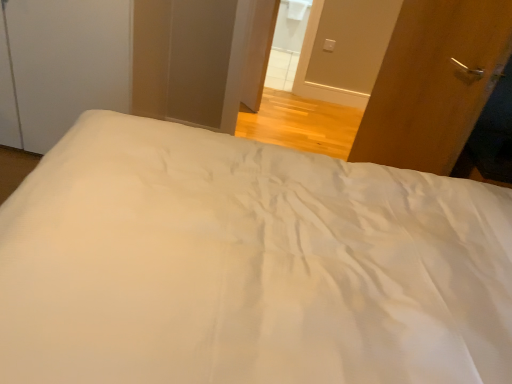
Where is `wooden door at right`? The width and height of the screenshot is (512, 384). wooden door at right is located at coordinates (434, 83).

In order to click on white matte screen door at upper left, the 1th screen door viewed from the left in this screenshot , I will do `click(67, 63)`.

What do you see at coordinates (67, 63) in the screenshot? I see `white matte screen door at upper left, the 1th screen door viewed from the left` at bounding box center [67, 63].

Describe the element at coordinates (247, 265) in the screenshot. This screenshot has width=512, height=384. I see `white smooth bed at center` at that location.

Measure the distance between white glossy door at upper center, which appears as the first screen door when viewed from the right, and camera.

The distance of white glossy door at upper center, which appears as the first screen door when viewed from the right, from camera is 3.35 meters.

You are a GUI agent. You are given a task and a screenshot of the screen. Output one action in this format:
    pyautogui.click(x=<x>, y=<y>)
    Task: Click on the wooden door at right
    This screenshot has width=512, height=384.
    Given the screenshot: What is the action you would take?
    pyautogui.click(x=434, y=83)

Is white matte screen door at upper left, the 2th screen door positioned from the right, in front of or behind white glossy door at upper center, which ranks as the second screen door in left-to-right order, in the image?

white matte screen door at upper left, the 2th screen door positioned from the right, is in front of white glossy door at upper center, which ranks as the second screen door in left-to-right order.

Can you tell me how much white matte screen door at upper left, the 1th screen door viewed from the left, and white glossy door at upper center, which appears as the first screen door when viewed from the right, differ in facing direction?

They differ by 1.06 degrees in their facing directions.

Based on their positions, is white matte screen door at upper left, the 2th screen door positioned from the right, located to the left or right of white glossy door at upper center, which ranks as the second screen door in left-to-right order?

Based on their positions, white matte screen door at upper left, the 2th screen door positioned from the right, is located to the left of white glossy door at upper center, which ranks as the second screen door in left-to-right order.

Is white glossy door at upper center, which ranks as the second screen door in left-to-right order, completely or partially inside white matte screen door at upper left, the 1th screen door viewed from the left?

That's incorrect, white glossy door at upper center, which ranks as the second screen door in left-to-right order, is not inside white matte screen door at upper left, the 1th screen door viewed from the left.

Does point (333, 5) come in front of point (101, 187)?

No, (333, 5) is further to viewer.

Who is bigger, white glossy door at upper center, which ranks as the second screen door in left-to-right order, or white smooth bed at center?

Bigger between the two is white smooth bed at center.

Consider the image. Does white glossy door at upper center, which appears as the first screen door when viewed from the right, have a lesser width compared to white smooth bed at center?

Correct, the width of white glossy door at upper center, which appears as the first screen door when viewed from the right, is less than that of white smooth bed at center.

Identify the location of bed lying below the white glossy door at upper center, which ranks as the second screen door in left-to-right order (from the image's perspective). The width and height of the screenshot is (512, 384). (247, 265).

Would you say wooden door at right is to the left or to the right of white glossy door at upper center, which ranks as the second screen door in left-to-right order, in the picture?

Based on their positions, wooden door at right is located to the right of white glossy door at upper center, which ranks as the second screen door in left-to-right order.

Can you confirm if wooden door at right is taller than white glossy door at upper center, which ranks as the second screen door in left-to-right order?

Indeed, wooden door at right has a greater height compared to white glossy door at upper center, which ranks as the second screen door in left-to-right order.

Which object is closer to the camera, wooden door at right or white glossy door at upper center, which ranks as the second screen door in left-to-right order?

wooden door at right is in front.

Does wooden door at right have a lesser width compared to white glossy door at upper center, which ranks as the second screen door in left-to-right order?

Yes, wooden door at right is thinner than white glossy door at upper center, which ranks as the second screen door in left-to-right order.

Considering the sizes of objects white smooth bed at center and white glossy door at upper center, which ranks as the second screen door in left-to-right order, in the image provided, who is smaller, white smooth bed at center or white glossy door at upper center, which ranks as the second screen door in left-to-right order,?

white glossy door at upper center, which ranks as the second screen door in left-to-right order, is smaller.

Who is more distant, white smooth bed at center or white glossy door at upper center, which appears as the first screen door when viewed from the right?

Positioned behind is white glossy door at upper center, which appears as the first screen door when viewed from the right.

Is white smooth bed at center touching white glossy door at upper center, which ranks as the second screen door in left-to-right order?

No.

Find the location of a particular element. bed in front of the white glossy door at upper center, which appears as the first screen door when viewed from the right is located at coordinates (247, 265).

Can you confirm if white glossy door at upper center, which ranks as the second screen door in left-to-right order, is bigger than white matte screen door at upper left, the 1th screen door viewed from the left?

No, white glossy door at upper center, which ranks as the second screen door in left-to-right order, is not bigger than white matte screen door at upper left, the 1th screen door viewed from the left.

This screenshot has width=512, height=384. Find the location of `screen door behind the white matte screen door at upper left, the 1th screen door viewed from the left`. screen door behind the white matte screen door at upper left, the 1th screen door viewed from the left is located at coordinates (344, 49).

Does white glossy door at upper center, which appears as the first screen door when viewed from the right, turn towards white matte screen door at upper left, the 2th screen door positioned from the right?

No, white glossy door at upper center, which appears as the first screen door when viewed from the right, does not turn towards white matte screen door at upper left, the 2th screen door positioned from the right.

Does wooden door at right touch white matte screen door at upper left, the 1th screen door viewed from the left?

wooden door at right and white matte screen door at upper left, the 1th screen door viewed from the left, are not in contact.

Is white matte screen door at upper left, the 1th screen door viewed from the left, at the back of wooden door at right?

wooden door at right is not turned away from white matte screen door at upper left, the 1th screen door viewed from the left.

Which object is further away from the camera, wooden door at right or white matte screen door at upper left, the 2th screen door positioned from the right?

Positioned behind is white matte screen door at upper left, the 2th screen door positioned from the right.

From a real-world perspective, between white smooth bed at center and white matte screen door at upper left, the 2th screen door positioned from the right, who is vertically lower?

white matte screen door at upper left, the 2th screen door positioned from the right, from a real-world perspective.

Can you confirm if white smooth bed at center is smaller than white matte screen door at upper left, the 2th screen door positioned from the right?

No, white smooth bed at center is not smaller than white matte screen door at upper left, the 2th screen door positioned from the right.

Identify the location of bed above the white matte screen door at upper left, the 1th screen door viewed from the left (from a real-world perspective). The height and width of the screenshot is (384, 512). (247, 265).

Which is in front, point (371, 237) or point (89, 0)?

The point (371, 237) is more forward.

Where is `screen door behind the white matte screen door at upper left, the 1th screen door viewed from the left`? screen door behind the white matte screen door at upper left, the 1th screen door viewed from the left is located at coordinates click(x=344, y=49).

Where is `bed that is under the white glossy door at upper center, which appears as the first screen door when viewed from the right (from a real-world perspective)`? This screenshot has width=512, height=384. bed that is under the white glossy door at upper center, which appears as the first screen door when viewed from the right (from a real-world perspective) is located at coordinates (247, 265).

Consider the image. From the image, which object appears to be farther from white matte screen door at upper left, the 2th screen door positioned from the right, white glossy door at upper center, which appears as the first screen door when viewed from the right, or white smooth bed at center?

Among the two, white glossy door at upper center, which appears as the first screen door when viewed from the right, is located further to white matte screen door at upper left, the 2th screen door positioned from the right.

Considering their positions, is white matte screen door at upper left, the 2th screen door positioned from the right, positioned further to white smooth bed at center than wooden door at right?

white matte screen door at upper left, the 2th screen door positioned from the right.

Based on their spatial positions, is white smooth bed at center or wooden door at right further from white glossy door at upper center, which ranks as the second screen door in left-to-right order?

white smooth bed at center lies further to white glossy door at upper center, which ranks as the second screen door in left-to-right order, than the other object.

Looking at the image, which one is located further to white matte screen door at upper left, the 2th screen door positioned from the right, wooden door at right or white glossy door at upper center, which ranks as the second screen door in left-to-right order?

white glossy door at upper center, which ranks as the second screen door in left-to-right order, lies further to white matte screen door at upper left, the 2th screen door positioned from the right, than the other object.

Which object lies further to the anchor point white matte screen door at upper left, the 1th screen door viewed from the left, white smooth bed at center or wooden door at right?

Based on the image, wooden door at right appears to be further to white matte screen door at upper left, the 1th screen door viewed from the left.

From the image, which object appears to be farther from white matte screen door at upper left, the 1th screen door viewed from the left, white glossy door at upper center, which ranks as the second screen door in left-to-right order, or wooden door at right?

Based on the image, white glossy door at upper center, which ranks as the second screen door in left-to-right order, appears to be further to white matte screen door at upper left, the 1th screen door viewed from the left.

Which object lies nearer to the anchor point white glossy door at upper center, which ranks as the second screen door in left-to-right order, white smooth bed at center or white matte screen door at upper left, the 2th screen door positioned from the right?

white matte screen door at upper left, the 2th screen door positioned from the right, is positioned closer to the anchor white glossy door at upper center, which ranks as the second screen door in left-to-right order.

When comparing their distances from wooden door at right, does white glossy door at upper center, which appears as the first screen door when viewed from the right, or white smooth bed at center seem closer?

white smooth bed at center is positioned closer to the anchor wooden door at right.

Find the location of a particular element. Image resolution: width=512 pixels, height=384 pixels. door between white smooth bed at center and white matte screen door at upper left, the 1th screen door viewed from the left, in the front-back direction is located at coordinates (434, 83).

You are a GUI agent. You are given a task and a screenshot of the screen. Output one action in this format:
    pyautogui.click(x=<x>, y=<y>)
    Task: Click on the screen door situated between white matte screen door at upper left, the 1th screen door viewed from the left, and wooden door at right from left to right
    
    Given the screenshot: What is the action you would take?
    pyautogui.click(x=344, y=49)

Image resolution: width=512 pixels, height=384 pixels. I want to click on door positioned between white smooth bed at center and white glossy door at upper center, which appears as the first screen door when viewed from the right, from near to far, so [x=434, y=83].

I want to click on screen door between white smooth bed at center and white glossy door at upper center, which ranks as the second screen door in left-to-right order, in the front-back direction, so click(x=67, y=63).